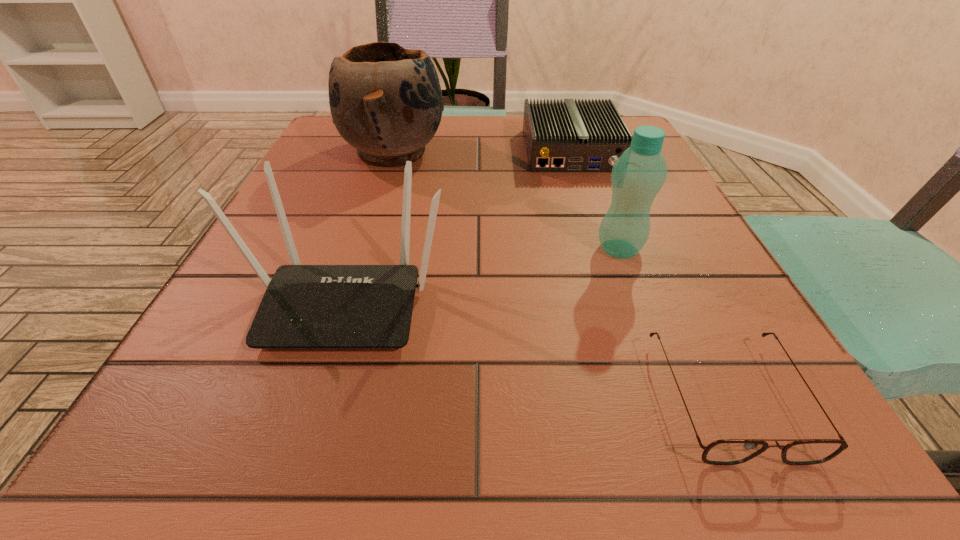
In order to click on empty space between the bottle and the fourth tallest object in this screenshot , I will do `click(595, 200)`.

The height and width of the screenshot is (540, 960). Identify the location of empty space between the pottery and the bottle. (507, 200).

What are the coordinates of `free point between the bottle and the farther router` in the screenshot? It's located at (595, 200).

Locate an element on the screen. This screenshot has width=960, height=540. free spot between the left router and the bottle is located at coordinates (483, 274).

Locate an element on the screen. This screenshot has width=960, height=540. free spot between the shortest object and the pottery is located at coordinates (562, 274).

Find the location of a particular element. unoccupied area between the pottery and the bottle is located at coordinates (507, 200).

What are the coordinates of `vacant space that's between the pottery and the taller router` in the screenshot? It's located at (370, 226).

You are a GUI agent. You are given a task and a screenshot of the screen. Output one action in this format:
    pyautogui.click(x=<x>, y=<y>)
    Task: Click on the object that stands as the fourth closest to the bottle
    The width and height of the screenshot is (960, 540).
    Given the screenshot: What is the action you would take?
    pyautogui.click(x=386, y=101)

Where is `object that stands as the second closest to the farther router`? object that stands as the second closest to the farther router is located at coordinates (637, 176).

Where is `free region that satisfies the following two spatial constraints: 1. on the back panel of the bottle; 2. on the left side of the farther router`? free region that satisfies the following two spatial constraints: 1. on the back panel of the bottle; 2. on the left side of the farther router is located at coordinates [x=604, y=249].